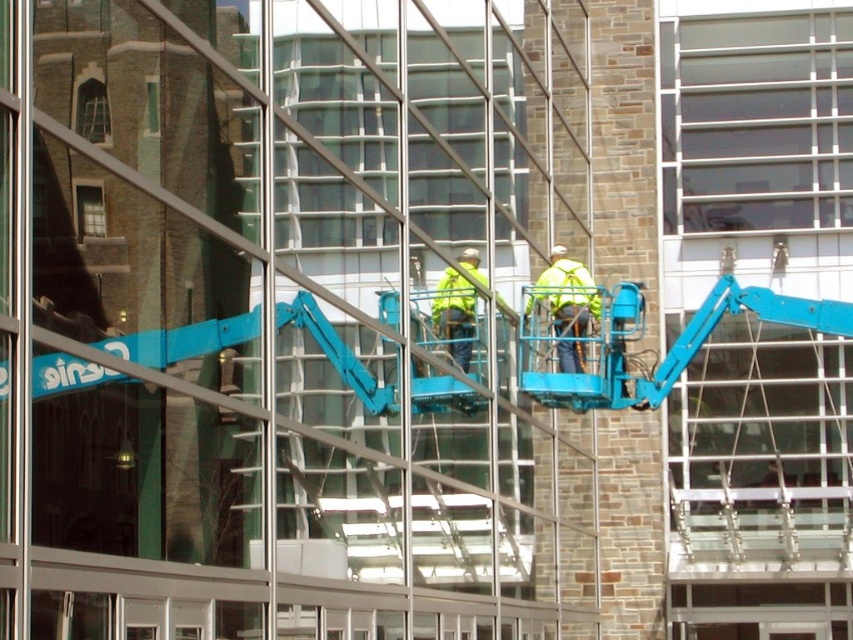
Can you confirm if yellow reflective safety vest at center is thinner than clear glass window at upper left?

No.

I want to click on yellow reflective safety vest at center, so click(453, 294).

Is point (93, 128) positioned behind point (450, 292)?

That is False.

Does brown stone window at upper left have a smaller size compared to yellow reflective safety vest at center?

Correct, brown stone window at upper left occupies less space than yellow reflective safety vest at center.

Who is more distant from viewer, (107, 102) or (436, 289)?

Point (436, 289)

Locate an element on the screen. This screenshot has width=853, height=640. brown stone window at upper left is located at coordinates (91, 112).

Can you confirm if matte glass window at upper left is positioned above clear glass window at upper left?

Incorrect, matte glass window at upper left is not positioned above clear glass window at upper left.

Is point (102, 205) positioned in front of point (155, 106)?

Yes, point (102, 205) is closer to viewer.

At what (x,y) coordinates should I click in order to perform the action: click on matte glass window at upper left. Please return your answer as a coordinate pair (x, y). Looking at the image, I should click on (90, 209).

You are a GUI agent. You are given a task and a screenshot of the screen. Output one action in this format:
    pyautogui.click(x=<x>, y=<y>)
    Task: Click on the matte glass window at upper left
    
    Given the screenshot: What is the action you would take?
    pyautogui.click(x=90, y=209)